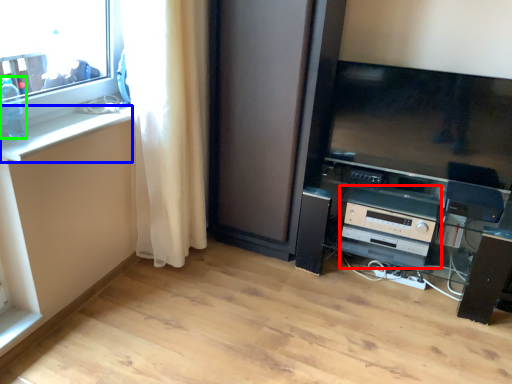
Question: Estimate the real-world distances between objects in this image. Which object is closer to appliance (highlighted by a red box), counter top (highlighted by a blue box) or bottle (highlighted by a green box)?

Choices:
 (A) counter top
 (B) bottle

Answer: (A)